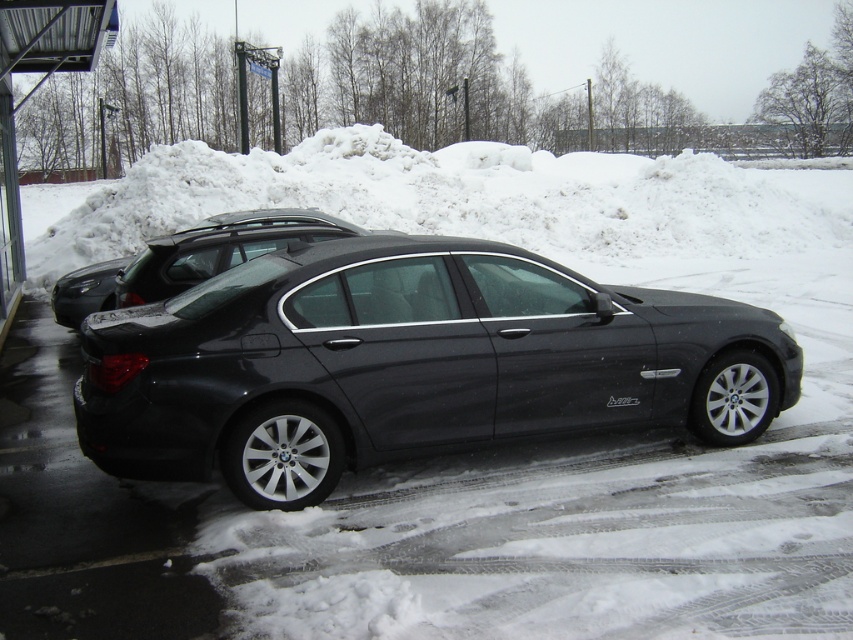
Question: Is the position of satin black sedan at center more distant than that of satin black car at center?

Choices:
 (A) no
 (B) yes

Answer: (A)

Question: Which object is positioned closest to the satin black car at center?

Choices:
 (A) satin black sedan at center
 (B) metallic silver bus stop at left

Answer: (B)

Question: Which object appears farthest from the camera in this image?

Choices:
 (A) metallic silver bus stop at left
 (B) satin black car at center

Answer: (A)

Question: Which of the following is the farthest from the observer?

Choices:
 (A) (55, 310)
 (B) (3, 58)
 (C) (486, 257)

Answer: (B)

Question: Can you confirm if satin black sedan at center is thinner than satin black car at center?

Choices:
 (A) yes
 (B) no

Answer: (A)

Question: Is the position of satin black car at center less distant than that of metallic silver bus stop at left?

Choices:
 (A) yes
 (B) no

Answer: (A)